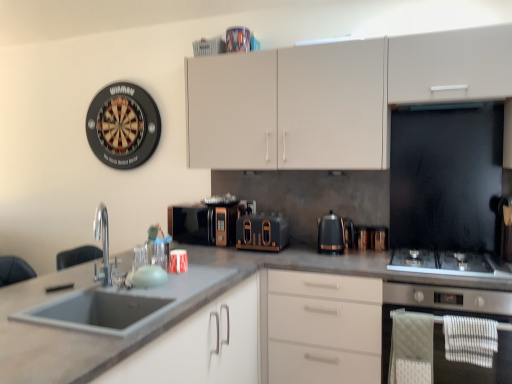
Question: Is matte gray sink at lower left, which is the second cabinetry from top to bottom, positioned with its back to stainless steel oven at lower right?

Choices:
 (A) yes
 (B) no

Answer: (B)

Question: Can you confirm if matte gray sink at lower left, acting as the 2th cabinetry starting from the right, is wider than stainless steel oven at lower right?

Choices:
 (A) yes
 (B) no

Answer: (B)

Question: Does matte gray sink at lower left, acting as the 2th cabinetry starting from the right, have a larger size compared to stainless steel oven at lower right?

Choices:
 (A) no
 (B) yes

Answer: (A)

Question: Does matte gray sink at lower left, which is the second cabinetry from top to bottom, turn towards stainless steel oven at lower right?

Choices:
 (A) yes
 (B) no

Answer: (B)

Question: Considering the relative sizes of matte gray sink at lower left, marked as the first cabinetry in a left-to-right arrangement, and stainless steel oven at lower right in the image provided, is matte gray sink at lower left, marked as the first cabinetry in a left-to-right arrangement, smaller than stainless steel oven at lower right?

Choices:
 (A) no
 (B) yes

Answer: (B)

Question: Considering the positions of gray matte countertop at center and stainless steel gas stove at right in the image, is gray matte countertop at center taller or shorter than stainless steel gas stove at right?

Choices:
 (A) short
 (B) tall

Answer: (B)

Question: In terms of size, does gray matte countertop at center appear bigger or smaller than stainless steel gas stove at right?

Choices:
 (A) small
 (B) big

Answer: (B)

Question: Is gray matte countertop at center spatially inside stainless steel gas stove at right, or outside of it?

Choices:
 (A) inside
 (B) outside

Answer: (B)

Question: Considering the positions of point (283, 251) and point (442, 261), is point (283, 251) closer or farther from the camera than point (442, 261)?

Choices:
 (A) closer
 (B) farther

Answer: (B)

Question: Visually, is metallic silver kettle at center, arranged as the 2th appliance when viewed from the left, positioned to the left or to the right of matte gray sink at lower left, acting as the 2th cabinetry starting from the right?

Choices:
 (A) left
 (B) right

Answer: (B)

Question: Is metallic silver kettle at center, arranged as the 2th appliance when viewed from the left, wider or thinner than matte gray sink at lower left, which is the second cabinetry from top to bottom?

Choices:
 (A) thin
 (B) wide

Answer: (A)

Question: Is point (373, 228) closer or farther from the camera than point (259, 294)?

Choices:
 (A) closer
 (B) farther

Answer: (B)

Question: Looking at the image, does metallic silver kettle at center, which is the first appliance from right to left, seem bigger or smaller compared to matte gray sink at lower left, which is the second cabinetry from top to bottom?

Choices:
 (A) big
 (B) small

Answer: (B)

Question: In the image, is black metallic kettle at center on the left side or the right side of matte white cabinets at upper center, the first cabinetry viewed from the top?

Choices:
 (A) left
 (B) right

Answer: (A)

Question: Considering the positions of black metallic kettle at center and matte white cabinets at upper center, placed as the second cabinetry when sorted from left to right, in the image, is black metallic kettle at center wider or thinner than matte white cabinets at upper center, placed as the second cabinetry when sorted from left to right,?

Choices:
 (A) wide
 (B) thin

Answer: (B)